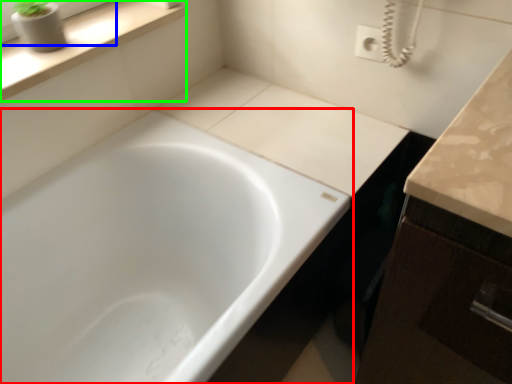
Question: Which object is the farthest from bathtub (highlighted by a red box)? Choose among these: window frame (highlighted by a blue box) or window sill (highlighted by a green box).

Choices:
 (A) window frame
 (B) window sill

Answer: (A)